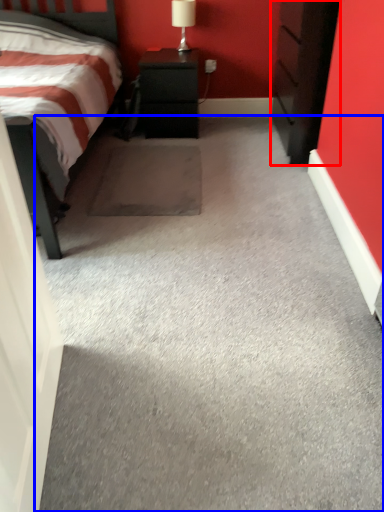
Question: Which object appears closest to the camera in this image, chest of drawers (highlighted by a red box) or concrete (highlighted by a blue box)?

Choices:
 (A) chest of drawers
 (B) concrete

Answer: (B)